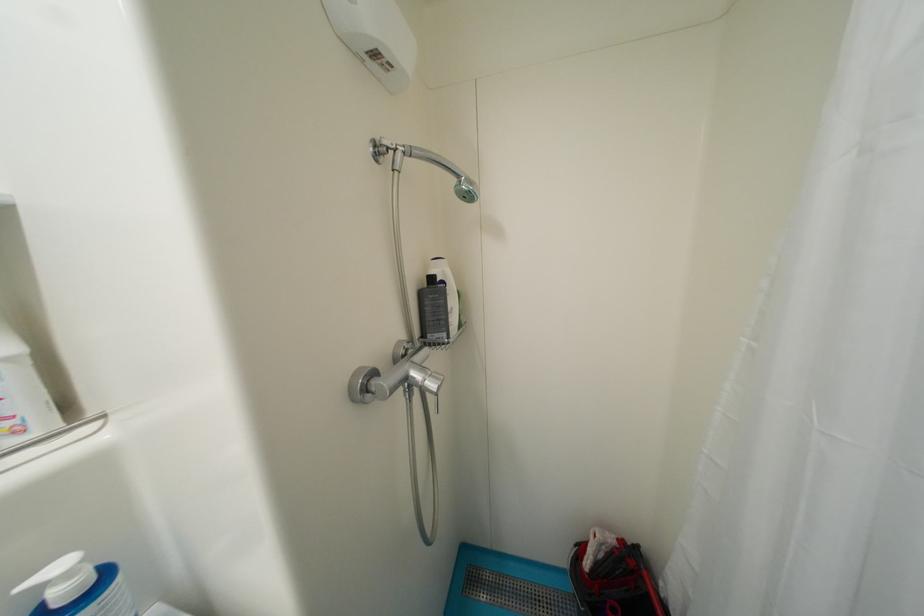
The image size is (924, 616). Describe the element at coordinates (426, 164) in the screenshot. I see `the metal shower head` at that location.